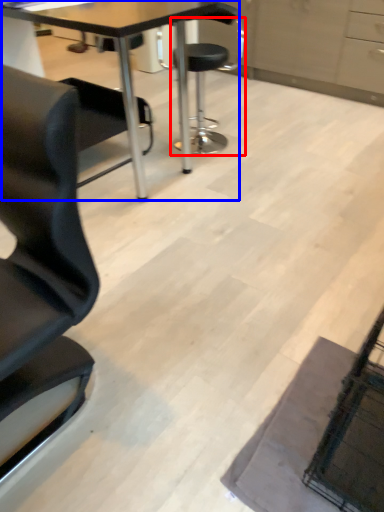
Question: Among these objects, which one is farthest to the camera, chair (highlighted by a red box) or table (highlighted by a blue box)?

Choices:
 (A) chair
 (B) table

Answer: (A)